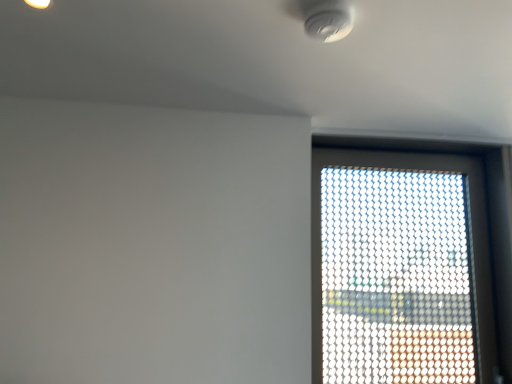
Question: Choose the correct answer: Is white plastic smoke detector at upper center inside transparent mesh window at upper right or outside it?

Choices:
 (A) outside
 (B) inside

Answer: (A)

Question: Is white plastic smoke detector at upper center bigger or smaller than transparent mesh window at upper right?

Choices:
 (A) big
 (B) small

Answer: (B)

Question: In the image, is white plastic smoke detector at upper center positioned in front of or behind transparent mesh window at upper right?

Choices:
 (A) behind
 (B) front

Answer: (B)

Question: Is transparent mesh window at upper right in front of or behind white plastic smoke detector at upper center in the image?

Choices:
 (A) front
 (B) behind

Answer: (B)

Question: Is transparent mesh window at upper right inside or outside of white plastic smoke detector at upper center?

Choices:
 (A) outside
 (B) inside

Answer: (A)

Question: Is transparent mesh window at upper right wider or thinner than white plastic smoke detector at upper center?

Choices:
 (A) wide
 (B) thin

Answer: (B)

Question: Visually, is transparent mesh window at upper right positioned to the left or to the right of white plastic smoke detector at upper center?

Choices:
 (A) left
 (B) right

Answer: (B)